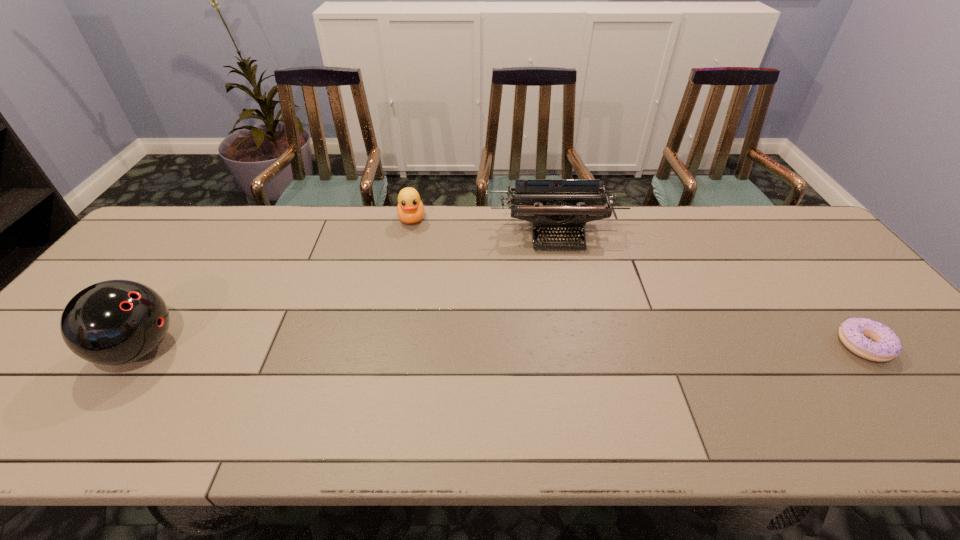
Image resolution: width=960 pixels, height=540 pixels. In order to click on unoccupied position between the bowling ball and the doughnut in this screenshot , I will do `click(501, 347)`.

Locate an element on the screen. vacant point located between the doughnut and the second object from left to right is located at coordinates (637, 282).

Where is `vacant area that lies between the doughnut and the leftmost object`? Image resolution: width=960 pixels, height=540 pixels. vacant area that lies between the doughnut and the leftmost object is located at coordinates (501, 347).

Image resolution: width=960 pixels, height=540 pixels. Find the location of `vacant space that's between the typewriter and the rightmost object`. vacant space that's between the typewriter and the rightmost object is located at coordinates (709, 289).

The image size is (960, 540). In order to click on free space that is in between the typewriter and the bowling ball in this screenshot , I will do `click(348, 291)`.

Locate an element on the screen. The image size is (960, 540). free area in between the duckling and the typewriter is located at coordinates (484, 226).

In order to click on object that stands as the closest to the shortest object in this screenshot , I will do `click(551, 204)`.

Image resolution: width=960 pixels, height=540 pixels. I want to click on object that is the second nearest to the shortest object, so click(x=410, y=209).

Image resolution: width=960 pixels, height=540 pixels. I want to click on vacant space that satisfies the following two spatial constraints: 1. on the front side of the third object from left to right; 2. on the left side of the second object from left to right, so click(x=408, y=234).